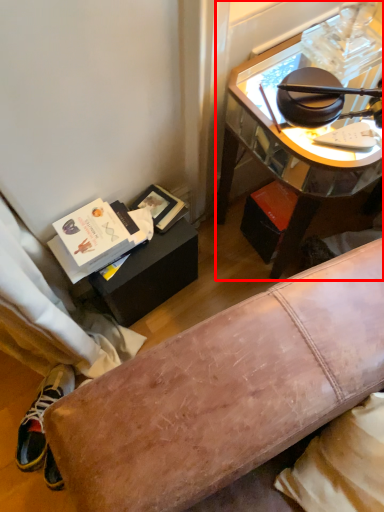
Question: From the image's perspective, what is the correct spatial relationship of desk (annotated by the red box) in relation to shoe?

Choices:
 (A) below
 (B) above

Answer: (B)